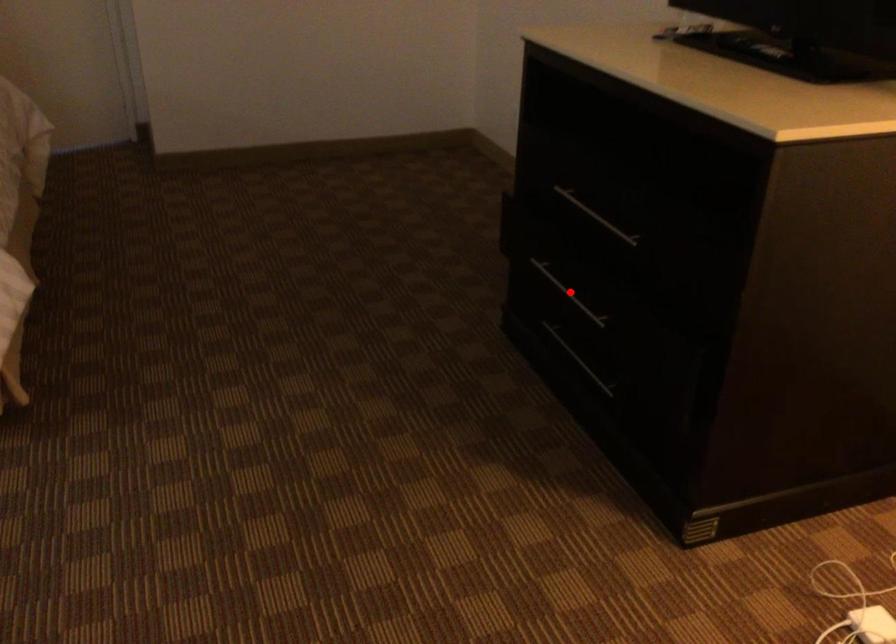
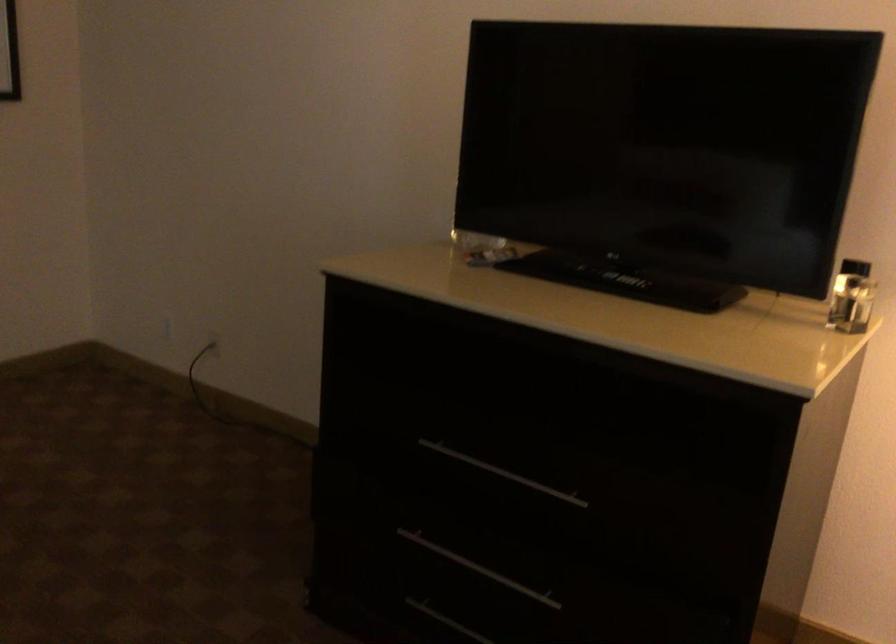
In the second image, find the point that corresponds to the highlighted location in the first image.

(478, 567)